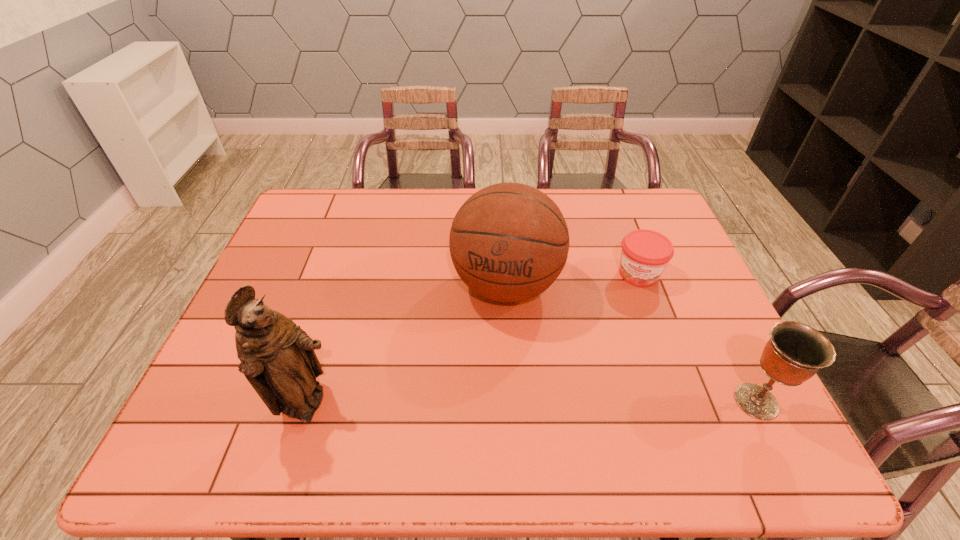
This screenshot has width=960, height=540. What are the coordinates of `empty location between the third tallest object and the shortest object` in the screenshot? It's located at (698, 338).

The image size is (960, 540). I want to click on free space between the second object from right to left and the leftmost object, so click(473, 340).

Find the location of a particular element. free spot between the basketball and the figurine is located at coordinates (407, 345).

The height and width of the screenshot is (540, 960). Identify the location of empty space that is in between the second object from left to right and the leftmost object. (407, 345).

Identify the location of free space between the third object from right to left and the second shortest object. This screenshot has height=540, width=960. (632, 343).

Identify the location of object that is the second nearest to the third tallest object. [509, 242].

Find the location of a particular element. the third closest object to the figurine is located at coordinates (795, 352).

Where is `free space that satisfies the following two spatial constraints: 1. on the back side of the second object from right to left; 2. on the left side of the basketball`? This screenshot has height=540, width=960. free space that satisfies the following two spatial constraints: 1. on the back side of the second object from right to left; 2. on the left side of the basketball is located at coordinates (506, 274).